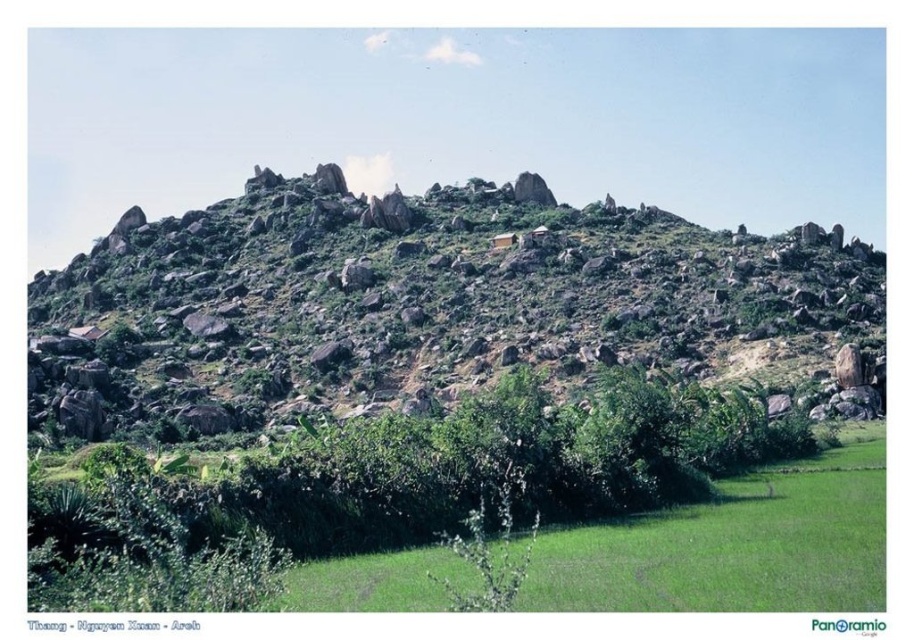
You are standing in the foreground of the scene looking towards the rocky hill. There are two points marked in the image, point (875, 328) and point (594, 548). Which point is closer to you?

Point (594, 548) is closer to you because it is less further to the camera than point (875, 328).

You are a hiker standing at the bottom of the rough stone mountain at upper center. You want to reach the summit. Which direction should you head to climb the mountain?

You should head towards the upper center direction to climb the rough stone mountain at upper center since the mountain is located at that point.

You are a hiker planning to cross from the green grassy at lower center to the rough stone mountain at upper center. Considering their sizes, which area might be more challenging to navigate and why?

The rough stone mountain at upper center has a larger size compared to the green grassy at lower center. The larger size of the mountain likely means a steeper incline and more rugged terrain, making it more challenging to navigate than the smaller, flatter green grassy area.